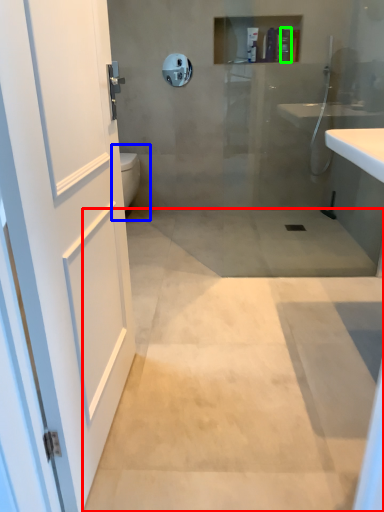
Question: Which object is the closest to the concrete (highlighted by a red box)? Choose among these: toilet bowl (highlighted by a blue box) or toiletry (highlighted by a green box).

Choices:
 (A) toilet bowl
 (B) toiletry

Answer: (A)